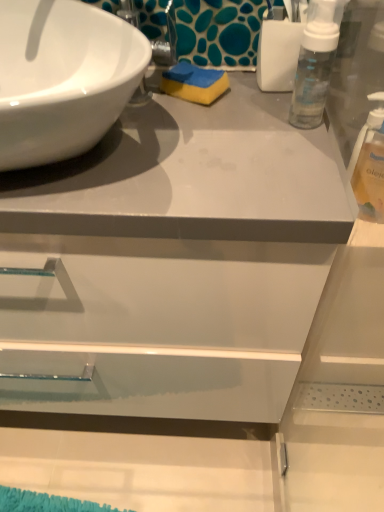
This screenshot has height=512, width=384. Find the location of `empty space that is in between white glossy sink at upper left and blue/yellow sponge at center`. empty space that is in between white glossy sink at upper left and blue/yellow sponge at center is located at coordinates (184, 138).